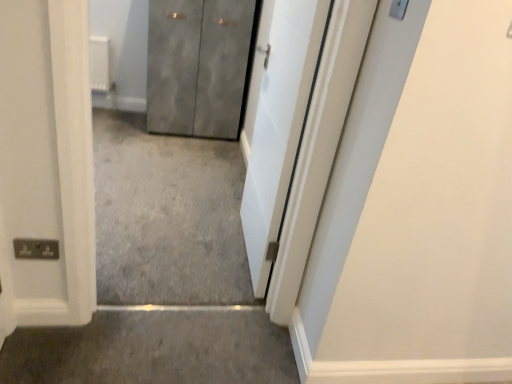
Question: Is white smooth door at center, marked as the first door in a right-to-left arrangement, in front of gray carpet at lower center?

Choices:
 (A) no
 (B) yes

Answer: (B)

Question: From the image's perspective, is white smooth door at center, acting as the second door starting from the left, below gray carpet at lower center?

Choices:
 (A) no
 (B) yes

Answer: (A)

Question: Can gray carpet at lower center be found inside white smooth door at center, the 1th door positioned from the front?

Choices:
 (A) no
 (B) yes

Answer: (A)

Question: Is white smooth door at center, marked as the first door in a right-to-left arrangement, behind gray carpet at lower center?

Choices:
 (A) no
 (B) yes

Answer: (A)

Question: Is white smooth door at center, the 1th door positioned from the front, facing towards gray carpet at lower center?

Choices:
 (A) yes
 (B) no

Answer: (B)

Question: From the image's perspective, is white smooth door at center, positioned as the second door in back-to-front order, located above or below gray carpet at lower center?

Choices:
 (A) above
 (B) below

Answer: (A)

Question: In terms of size, does white smooth door at center, marked as the first door in a right-to-left arrangement, appear bigger or smaller than gray carpet at lower center?

Choices:
 (A) big
 (B) small

Answer: (A)

Question: From a real-world perspective, is white smooth door at center, the 1th door positioned from the front, above or below gray carpet at lower center?

Choices:
 (A) above
 (B) below

Answer: (A)

Question: In the image, is white smooth door at center, the 1th door positioned from the front, on the left side or the right side of gray carpet at lower center?

Choices:
 (A) right
 (B) left

Answer: (A)

Question: From the image's perspective, is metallic gray cabinet at center, which ranks as the 2th door in front-to-back order, positioned above or below white smooth door at center, positioned as the second door in back-to-front order?

Choices:
 (A) below
 (B) above

Answer: (B)

Question: Looking at the image, does metallic gray cabinet at center, which is the second door in right-to-left order, seem bigger or smaller compared to white smooth door at center, marked as the first door in a right-to-left arrangement?

Choices:
 (A) small
 (B) big

Answer: (B)

Question: From their relative heights in the image, would you say metallic gray cabinet at center, which is the second door in right-to-left order, is taller or shorter than white smooth door at center, positioned as the second door in back-to-front order?

Choices:
 (A) short
 (B) tall

Answer: (A)

Question: Looking at their shapes, would you say metallic gray cabinet at center, which is the second door in right-to-left order, is wider or thinner than white smooth door at center, the 1th door positioned from the front?

Choices:
 (A) wide
 (B) thin

Answer: (A)

Question: Considering the positions of metallic gray cabinet at center, marked as the 1th door in a back-to-front arrangement, and gray carpet at lower center in the image, is metallic gray cabinet at center, marked as the 1th door in a back-to-front arrangement, bigger or smaller than gray carpet at lower center?

Choices:
 (A) big
 (B) small

Answer: (A)

Question: In terms of width, does metallic gray cabinet at center, which ranks as the 2th door in front-to-back order, look wider or thinner when compared to gray carpet at lower center?

Choices:
 (A) wide
 (B) thin

Answer: (A)